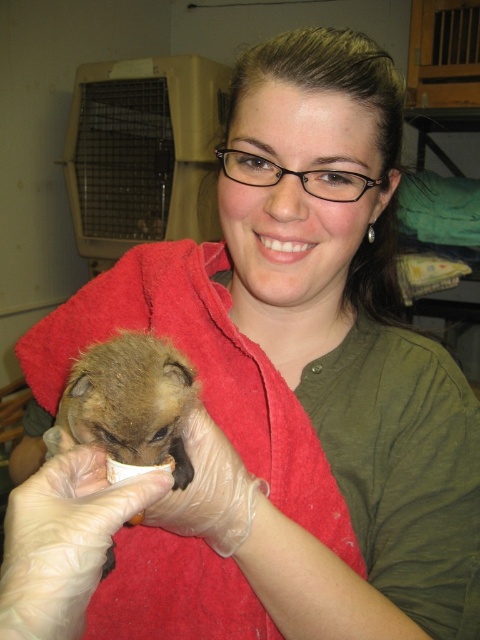
Is transparent plastic glove at lower left bigger than transparent plastic glove at center?

Indeed, transparent plastic glove at lower left has a larger size compared to transparent plastic glove at center.

Does point (12, 634) come behind point (204, 497)?

No, (12, 634) is in front of (204, 497).

Does point (16, 611) come in front of point (215, 445)?

Yes, it is.

Locate an element on the screen. transparent plastic glove at lower left is located at coordinates (63, 541).

Between brown fuzzy bat at center and transparent plastic glove at center, which one appears on the right side from the viewer's perspective?

Positioned to the right is transparent plastic glove at center.

Does brown fuzzy bat at center appear under transparent plastic glove at center?

Incorrect, brown fuzzy bat at center is not positioned below transparent plastic glove at center.

Between point (112, 349) and point (257, 509), which one is positioned behind?

The point (112, 349) is more distant.

Image resolution: width=480 pixels, height=640 pixels. I want to click on brown fuzzy bat at center, so click(x=132, y=401).

Consider the image. Between transparent plastic glove at lower left and brown fuzzy bat at center, which one appears on the left side from the viewer's perspective?

From the viewer's perspective, brown fuzzy bat at center appears more on the left side.

Does transparent plastic glove at lower left have a smaller size compared to brown fuzzy bat at center?

Yes.

Locate an element on the screen. This screenshot has width=480, height=640. transparent plastic glove at lower left is located at coordinates (63, 541).